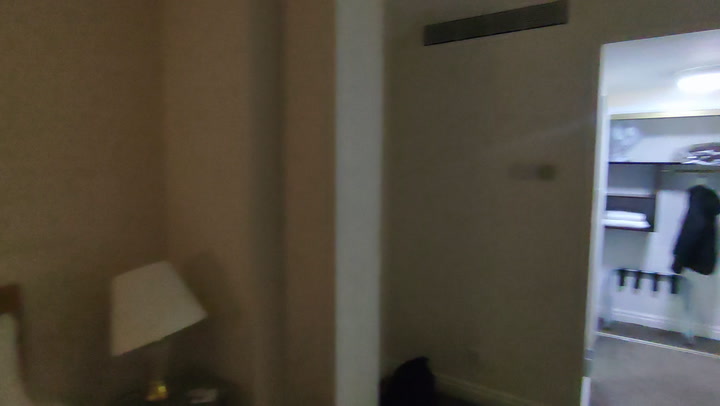
Find the location of a particular element. The height and width of the screenshot is (406, 720). patch of dark gray carpeting is located at coordinates (642, 335).